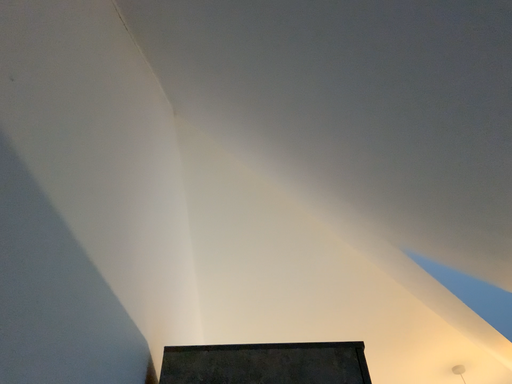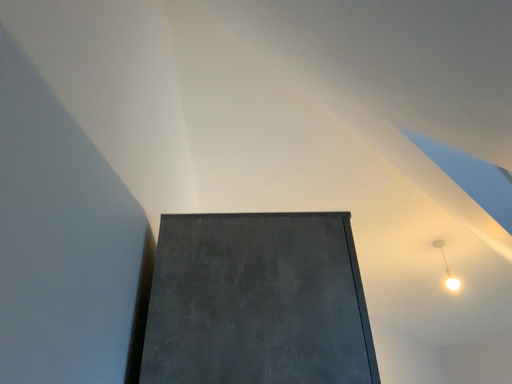
Question: Which way did the camera rotate in the video?

Choices:
 (A) rotated upward
 (B) rotated downward

Answer: (B)